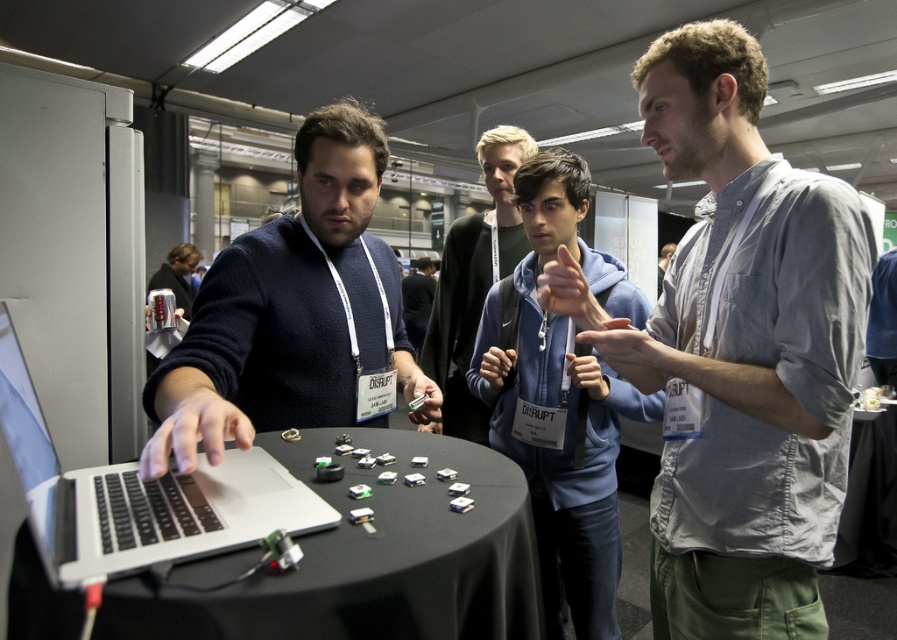
Can you confirm if black fabric table at center is positioned to the left of silver metallic laptop at center?

No, black fabric table at center is not to the left of silver metallic laptop at center.

In the scene shown: Measure the distance between black fabric table at center and silver metallic laptop at center.

They are 11.98 centimeters apart.

Describe the element at coordinates (369, 561) in the screenshot. I see `black fabric table at center` at that location.

This screenshot has width=897, height=640. I want to click on black fabric table at center, so click(x=369, y=561).

Does dark blue sweater at center have a lesser width compared to dark blue hoodie at center?

In fact, dark blue sweater at center might be wider than dark blue hoodie at center.

Can you confirm if dark blue sweater at center is smaller than dark blue hoodie at center?

Indeed, dark blue sweater at center has a smaller size compared to dark blue hoodie at center.

Find the location of a particular element. dark blue sweater at center is located at coordinates (293, 314).

Between point (468, 404) and point (408, 340), which one is positioned behind?

Positioned behind is point (408, 340).

Is point (457, 330) positioned behind point (425, 307)?

No.

What are the coordinates of `dark green sweater at center` in the screenshot? It's located at (475, 282).

Image resolution: width=897 pixels, height=640 pixels. I want to click on dark green sweater at center, so click(475, 282).